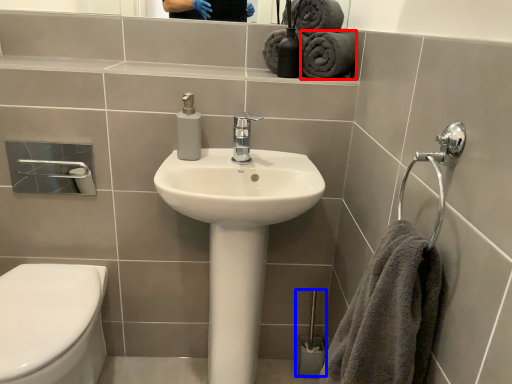
Question: Which object is closer to the camera taking this photo, bath towel (highlighted by a red box) or brush (highlighted by a blue box)?

Choices:
 (A) bath towel
 (B) brush

Answer: (A)